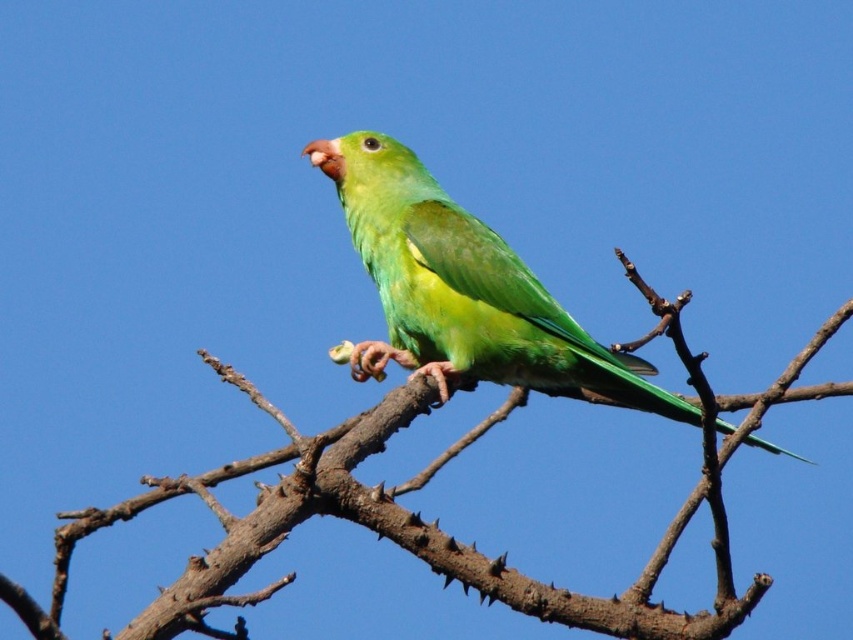
You are a birdwatcher trying to identify the species of the parakeet in the image. The parakeet is perched on a branch located at a specific coordinate. Which object is at the coordinate point [421,516]?

The point [421,516] indicates the brown rough branch at center where the parakeet is perched.

You are a birdwatcher observing the brown rough branch at center and the green matte parrot at center. Which object is located below the other?

The brown rough branch at center is positioned under the green matte parrot at center, so the branch is below the parrot.